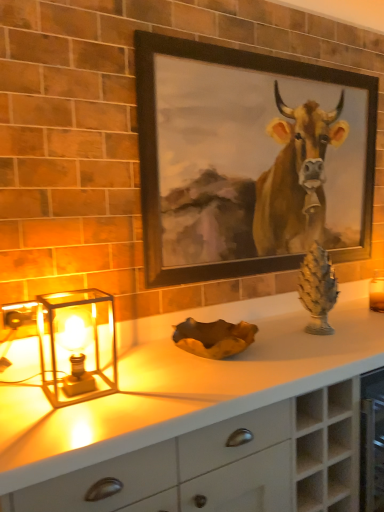
Identify the location of black matte picture frame at upper center. pyautogui.click(x=248, y=160).

The width and height of the screenshot is (384, 512). Describe the element at coordinates (78, 345) in the screenshot. I see `translucent glass table lamp at left` at that location.

What is the approximate width of translucent glass table lamp at left?

translucent glass table lamp at left is 8.64 inches wide.

This screenshot has width=384, height=512. I want to click on green stone pine cone at right, so (x=317, y=289).

Looking at this image, does black matte picture frame at upper center have a greater height compared to translucent glass table lamp at left?

Indeed, black matte picture frame at upper center has a greater height compared to translucent glass table lamp at left.

From the image's perspective, is black matte picture frame at upper center on top of translucent glass table lamp at left?

Indeed, from the image's perspective, black matte picture frame at upper center is shown above translucent glass table lamp at left.

Is point (263, 81) closer or farther from the camera than point (83, 350)?

Point (263, 81) is positioned farther from the camera compared to point (83, 350).

I want to click on table lamp on the left side of black matte picture frame at upper center, so click(x=78, y=345).

Can black matte picture frame at upper center be found inside green stone pine cone at right?

No.

Considering the sizes of objects green stone pine cone at right and black matte picture frame at upper center in the image provided, who is thinner, green stone pine cone at right or black matte picture frame at upper center?

Thinner between the two is black matte picture frame at upper center.

Considering the relative sizes of green stone pine cone at right and black matte picture frame at upper center in the image provided, is green stone pine cone at right bigger than black matte picture frame at upper center?

No, green stone pine cone at right is not bigger than black matte picture frame at upper center.

From a real-world perspective, relative to black matte picture frame at upper center, is green stone pine cone at right vertically above or below?

In terms of real-world spatial position, green stone pine cone at right is below black matte picture frame at upper center.

Does translucent glass table lamp at left have a larger size compared to black matte picture frame at upper center?

Actually, translucent glass table lamp at left might be smaller than black matte picture frame at upper center.

From a real-world perspective, between translucent glass table lamp at left and black matte picture frame at upper center, who is vertically higher?

From a 3D spatial view, black matte picture frame at upper center is above.

Is translucent glass table lamp at left taller than black matte picture frame at upper center?

No, translucent glass table lamp at left is not taller than black matte picture frame at upper center.

Does point (78, 295) lie behind point (309, 220)?

No, it is in front of (309, 220).

Can you confirm if translucent glass table lamp at left is positioned to the right of white matte countertop at center?

No, translucent glass table lamp at left is not to the right of white matte countertop at center.

Does translucent glass table lamp at left have a greater width compared to white matte countertop at center?

Incorrect, the width of translucent glass table lamp at left does not surpass that of white matte countertop at center.

How distant is translucent glass table lamp at left from white matte countertop at center?

translucent glass table lamp at left is 10.25 inches from white matte countertop at center.

What's the angular difference between translucent glass table lamp at left and white matte countertop at center's facing directions?

The angular difference between translucent glass table lamp at left and white matte countertop at center is 0.00117 degrees.

Where is `table lamp on the left of white matte countertop at center`? table lamp on the left of white matte countertop at center is located at coordinates (78, 345).

Looking at this image, can you tell me how much white matte countertop at center and translucent glass table lamp at left differ in facing direction?

They differ by 0.00117 degrees in their facing directions.

Is white matte countertop at center completely or partially outside of translucent glass table lamp at left?

white matte countertop at center is positioned outside translucent glass table lamp at left.

Relative to translucent glass table lamp at left, is white matte countertop at center in front or behind?

white matte countertop at center is positioned closer to the viewer than translucent glass table lamp at left.

From the image's perspective, is white matte countertop at center located above or below green stone pine cone at right?

white matte countertop at center is below green stone pine cone at right.

Between white matte countertop at center and green stone pine cone at right, which one is positioned in front?

white matte countertop at center is closer to the camera.

Consider the image. Could green stone pine cone at right be considered to be inside white matte countertop at center?

No, green stone pine cone at right is not a part of white matte countertop at center.

Looking at this image, relative to translucent glass table lamp at left, is green stone pine cone at right in front or behind?

Clearly, green stone pine cone at right is behind translucent glass table lamp at left.

In the scene shown: Is green stone pine cone at right inside or outside of translucent glass table lamp at left?

green stone pine cone at right lies outside translucent glass table lamp at left.

You are a GUI agent. You are given a task and a screenshot of the screen. Output one action in this format:
    pyautogui.click(x=<x>, y=<y>)
    Task: Click on the table lamp below the black matte picture frame at upper center (from the image's perspective)
    
    Given the screenshot: What is the action you would take?
    [x=78, y=345]

Where is `picture frame located on the left of green stone pine cone at right`? This screenshot has height=512, width=384. picture frame located on the left of green stone pine cone at right is located at coordinates (248, 160).

In the scene shown: When comparing their distances from black matte picture frame at upper center, does translucent glass table lamp at left or green stone pine cone at right seem further?

translucent glass table lamp at left lies further to black matte picture frame at upper center than the other object.

Estimate the real-world distances between objects in this image. Which object is closer to black matte picture frame at upper center, translucent glass table lamp at left or white matte countertop at center?

translucent glass table lamp at left is closer to black matte picture frame at upper center.

Based on their spatial positions, is white matte countertop at center or black matte picture frame at upper center closer to green stone pine cone at right?

Based on the image, black matte picture frame at upper center appears to be nearer to green stone pine cone at right.

When comparing their distances from translucent glass table lamp at left, does white matte countertop at center or black matte picture frame at upper center seem further?

black matte picture frame at upper center is further to translucent glass table lamp at left.

Considering their positions, is white matte countertop at center positioned further to translucent glass table lamp at left than green stone pine cone at right?

Among the two, green stone pine cone at right is located further to translucent glass table lamp at left.

From the image, which object appears to be farther from black matte picture frame at upper center, green stone pine cone at right or white matte countertop at center?

The object further to black matte picture frame at upper center is white matte countertop at center.

In the scene shown: Based on their spatial positions, is white matte countertop at center or translucent glass table lamp at left further from green stone pine cone at right?

The object further to green stone pine cone at right is translucent glass table lamp at left.

Looking at the image, which one is located further to white matte countertop at center, translucent glass table lamp at left or black matte picture frame at upper center?

Based on the image, black matte picture frame at upper center appears to be further to white matte countertop at center.

The image size is (384, 512). In order to click on pine cone between black matte picture frame at upper center and white matte countertop at center vertically in this screenshot , I will do `click(317, 289)`.

Find the location of a particular element. This screenshot has width=384, height=512. table lamp between black matte picture frame at upper center and white matte countertop at center in the vertical direction is located at coordinates (78, 345).

Where is `countertop between translucent glass table lamp at left and green stone pine cone at right from left to right`? The image size is (384, 512). countertop between translucent glass table lamp at left and green stone pine cone at right from left to right is located at coordinates (200, 420).

The width and height of the screenshot is (384, 512). Find the location of `picture frame situated between translucent glass table lamp at left and green stone pine cone at right from left to right`. picture frame situated between translucent glass table lamp at left and green stone pine cone at right from left to right is located at coordinates (248, 160).